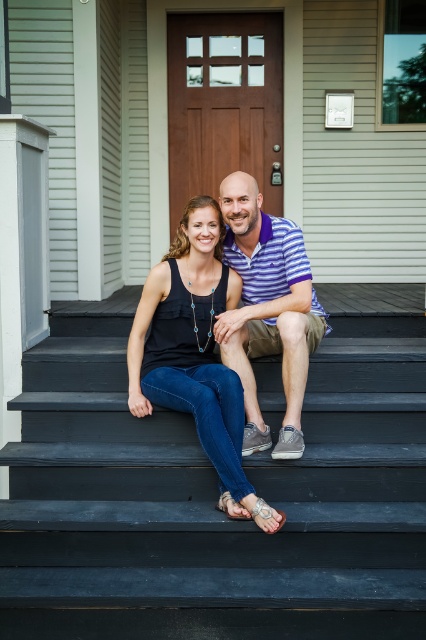
Based on the photo, you are a photographer standing in front of the house. You want to take a picture of the couple and the door. The point at coordinates point (195, 353) is on the matte black tank top at center. Where should you position yourself to ensure both the couple and the door are in the frame?

To capture both the couple and the door in the frame, position yourself so that the point at coordinates point (195, 353) on the matte black tank top at center is centered in your viewfinder. This will ensure the couple and the door are included in the shot.

You are standing in front of the house and want to reach the door. The smooth black stairs at center lead to the door. There is also a striped cotton polo shirt at center in your line of sight. Which object is closer to you?

The smooth black stairs at center are closer to the viewer than the striped cotton polo shirt at center, so the stairs are closer.

You are standing in front of the house and want to walk up the smooth black stairs at center. There is a person wearing the matte black tank top at center sitting on the stairs. Can you walk up the stairs without stepping on the person?

The smooth black stairs at center is closer to the viewer than matte black tank top at center, so the person is sitting on the stairs. Therefore, you cannot walk up the stairs without stepping on the person.